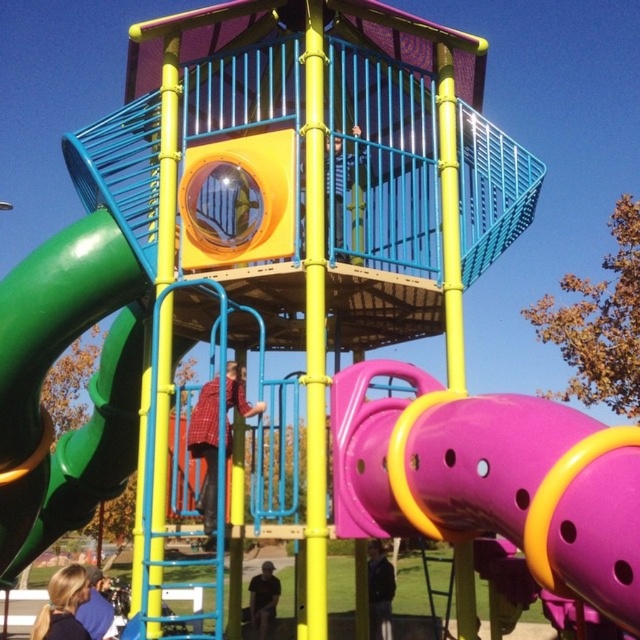
Which is in front, point (547, 472) or point (369, 589)?

Point (547, 472) is more forward.

Is the position of purple matte slide at center more distant than that of dark gray jacket at lower center?

No, purple matte slide at center is in front of dark gray jacket at lower center.

The image size is (640, 640). Describe the element at coordinates (492, 480) in the screenshot. I see `purple matte slide at center` at that location.

Locate an element on the screen. purple matte slide at center is located at coordinates (492, 480).

Is the position of purple matte slide at center more distant than that of dark gray shirt at lower center?

No, purple matte slide at center is in front of dark gray shirt at lower center.

Does purple matte slide at center have a greater height compared to dark gray shirt at lower center?

Indeed, purple matte slide at center has a greater height compared to dark gray shirt at lower center.

Where is `purple matte slide at center`? purple matte slide at center is located at coordinates (492, 480).

Is red plaid shirt at center to the right of blonde hair at lower left from the viewer's perspective?

Correct, you'll find red plaid shirt at center to the right of blonde hair at lower left.

Looking at this image, does red plaid shirt at center have a greater height compared to blonde hair at lower left?

Yes, red plaid shirt at center is taller than blonde hair at lower left.

Which is behind, point (209, 492) or point (61, 604)?

The point (209, 492) is more distant.

Locate an element on the screen. The image size is (640, 640). red plaid shirt at center is located at coordinates (205, 452).